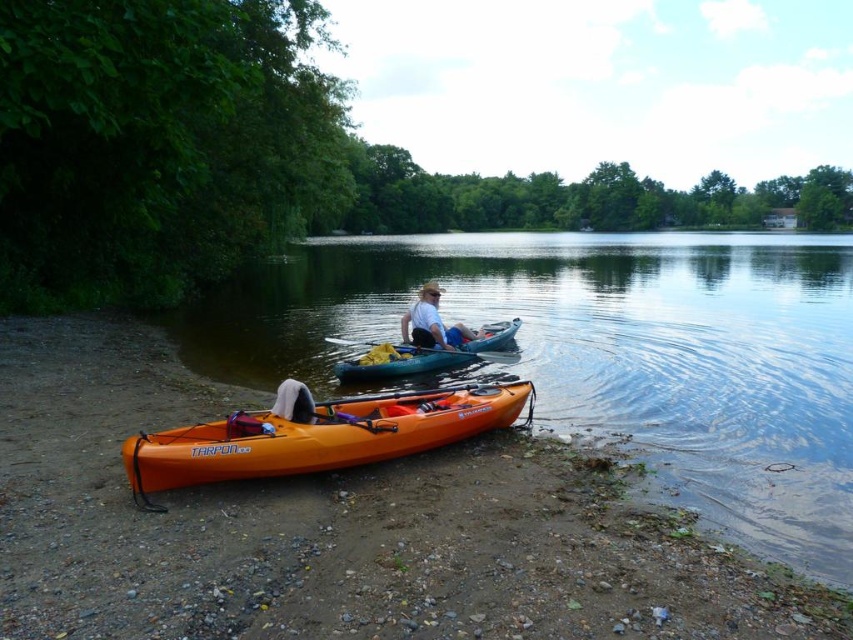
You are planning to take a kayak ride on the lake. You see the orange matte kayak at lower left and the teal rubber kayak at center. Which kayak has a larger width that could provide more stability?

The orange matte kayak at lower left might be wider than teal rubber kayak at center, so it could provide more stability for your ride.

You are standing at the point marked as point (428, 355). What object is located exactly at that point?

The teal rubber kayak at center is located exactly at point (428, 355).